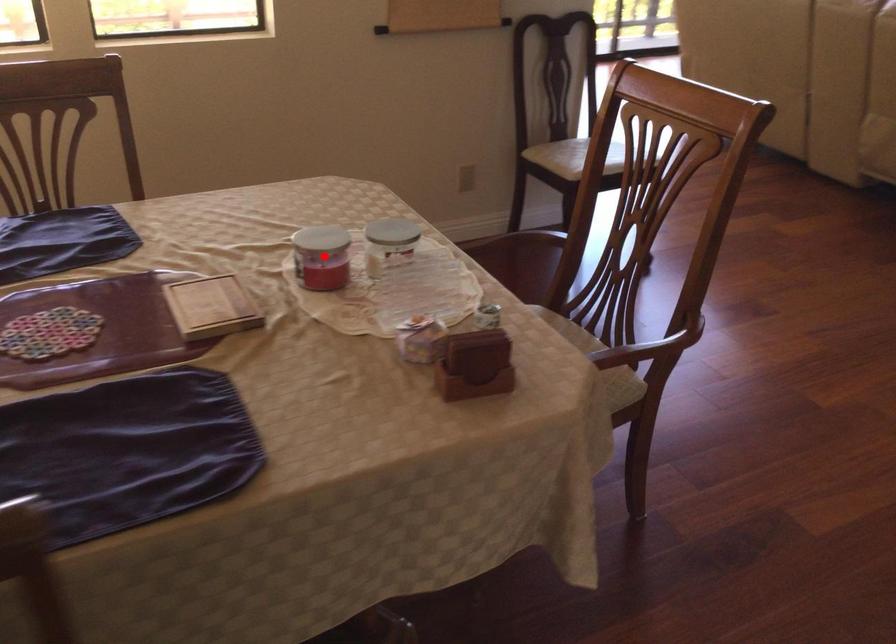
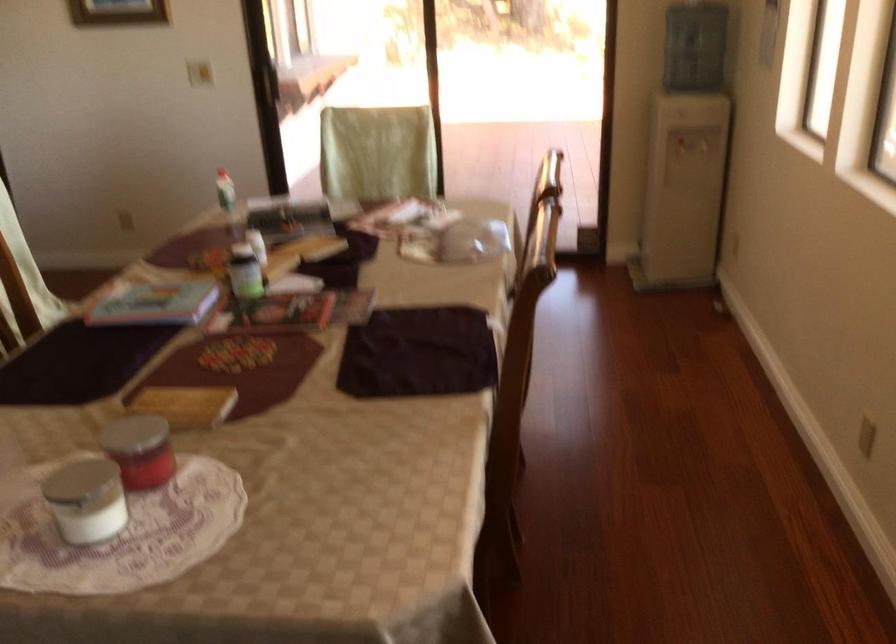
In the second image, find the point that corresponds to the highlighted location in the first image.

(162, 465)